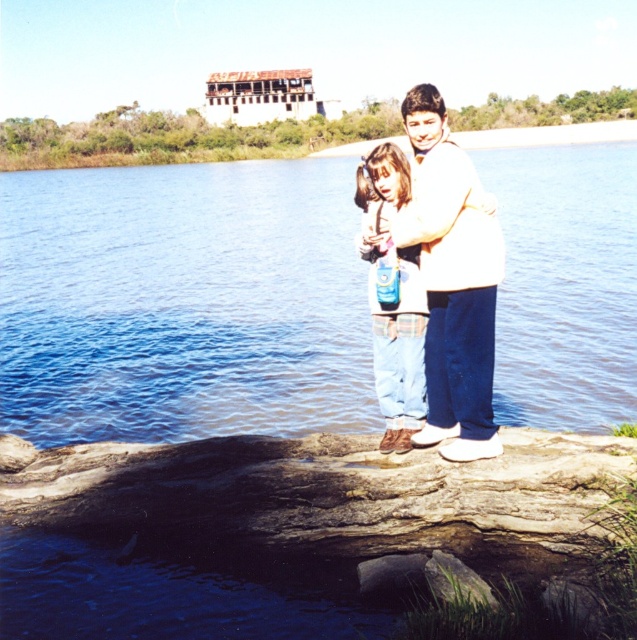
Question: Which object is positioned closest to the white cotton sweater at center?

Choices:
 (A) denim pants at center
 (B) blue liquid water at center

Answer: (A)

Question: Where is white cotton sweater at center located in relation to denim pants at center in the image?

Choices:
 (A) below
 (B) above

Answer: (B)

Question: Considering the real-world distances, which object is farthest from the white cotton sweater at center?

Choices:
 (A) denim pants at center
 (B) blue liquid water at center

Answer: (B)

Question: Does white cotton sweater at center come behind denim pants at center?

Choices:
 (A) no
 (B) yes

Answer: (A)

Question: Does blue liquid water at center appear on the left side of white cotton sweater at center?

Choices:
 (A) no
 (B) yes

Answer: (B)

Question: Which object is positioned closest to the blue liquid water at center?

Choices:
 (A) denim pants at center
 (B) white cotton sweater at center

Answer: (A)